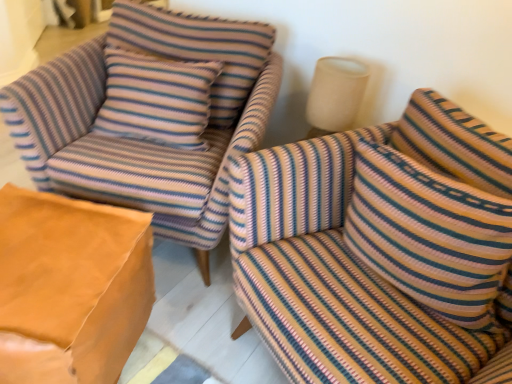
Question: Does point (212, 246) appear closer or farther from the camera than point (445, 304)?

Choices:
 (A) farther
 (B) closer

Answer: (A)

Question: Considering the positions of striped fabric armchair at upper left and striped fabric pillow at right in the image, is striped fabric armchair at upper left wider or thinner than striped fabric pillow at right?

Choices:
 (A) wide
 (B) thin

Answer: (A)

Question: Which object is the closest to the leather-like tan ottoman at lower left?

Choices:
 (A) striped fabric pillow at right
 (B) striped fabric armchair at upper left
 (C) striped fabric couch at right

Answer: (B)

Question: Based on their relative distances, which object is nearer to the striped fabric pillow at right?

Choices:
 (A) leather-like tan ottoman at lower left
 (B) striped fabric couch at right
 (C) striped fabric armchair at upper left

Answer: (B)